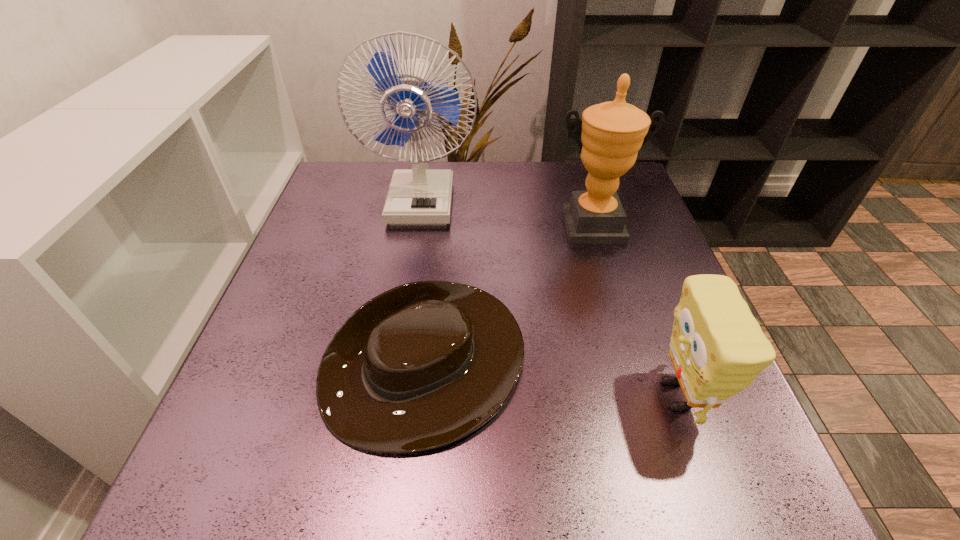
Locate an element on the screen. The height and width of the screenshot is (540, 960). free space between the cowboy hat and the award is located at coordinates (509, 296).

Where is `free spot between the third shortest object and the fan`? The image size is (960, 540). free spot between the third shortest object and the fan is located at coordinates 507,213.

I want to click on free point between the award and the third tallest object, so (x=635, y=311).

Locate an element on the screen. vacant region between the cowboy hat and the award is located at coordinates (509, 296).

Find the location of a particular element. object that is the second closest to the second tallest object is located at coordinates (420, 366).

Find the location of a particular element. The height and width of the screenshot is (540, 960). object that is the closest one to the award is located at coordinates click(x=419, y=196).

Where is `vacant space that satisfies the following two spatial constraints: 1. on the front-facing side of the fan; 2. on the right side of the cowboy hat`? vacant space that satisfies the following two spatial constraints: 1. on the front-facing side of the fan; 2. on the right side of the cowboy hat is located at coordinates (394, 367).